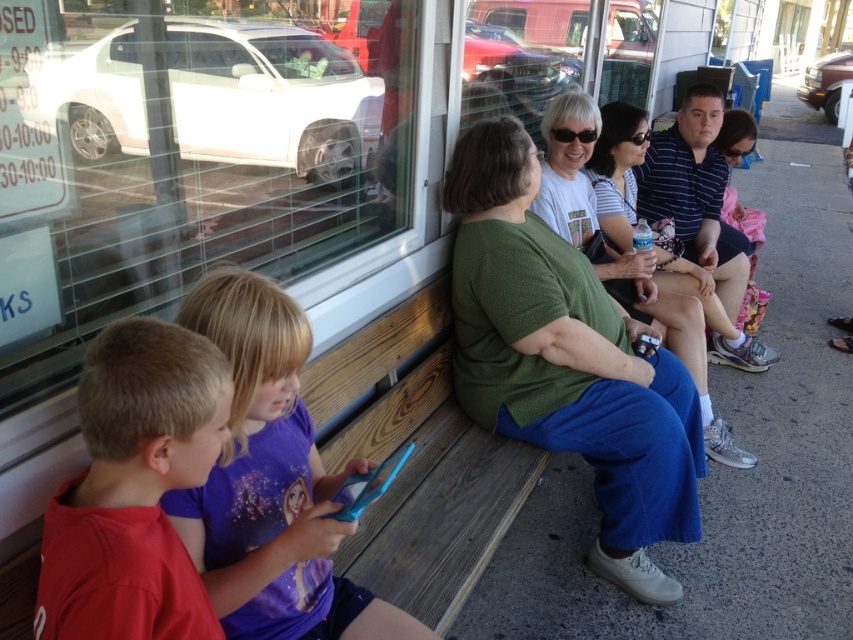
You are a photographer trying to capture a clear photo of the red cotton shirt at lower left and the purple fabric shirt at lower left. Since both are on the same bench, which one might block the other in your photo?

The purple fabric shirt at lower left is closer to you than the red cotton shirt at lower left, so it might block the view of the red cotton shirt at lower left in your photo.

You are standing in front of the bench where the children and adults are sitting. There is a point marked at coordinates [190,168]. Can you tell me what object this point is located on?

The point [190,168] is located on the transparent glass window at lower left.